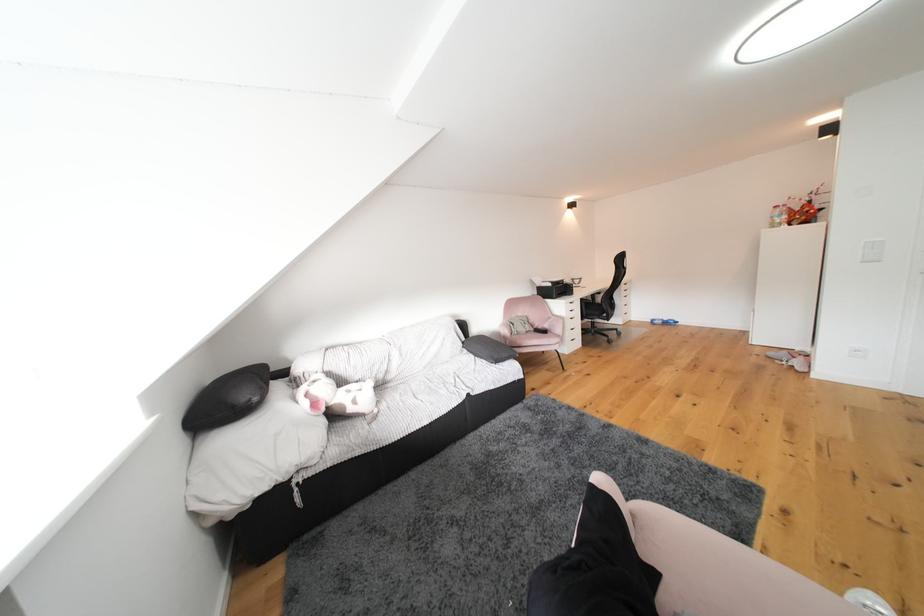
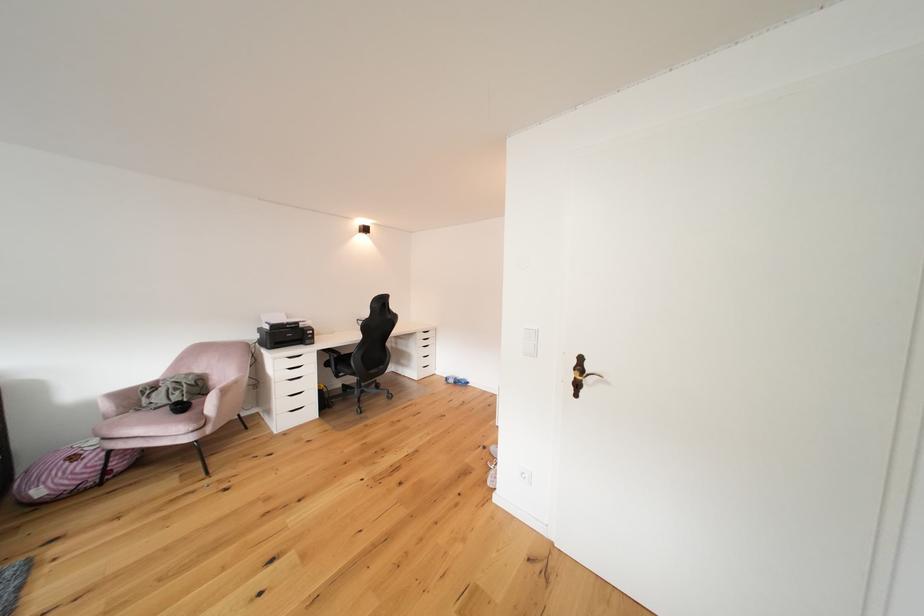
Find the pixel in the second image that matches (x=662, y=325) in the first image.

(456, 383)